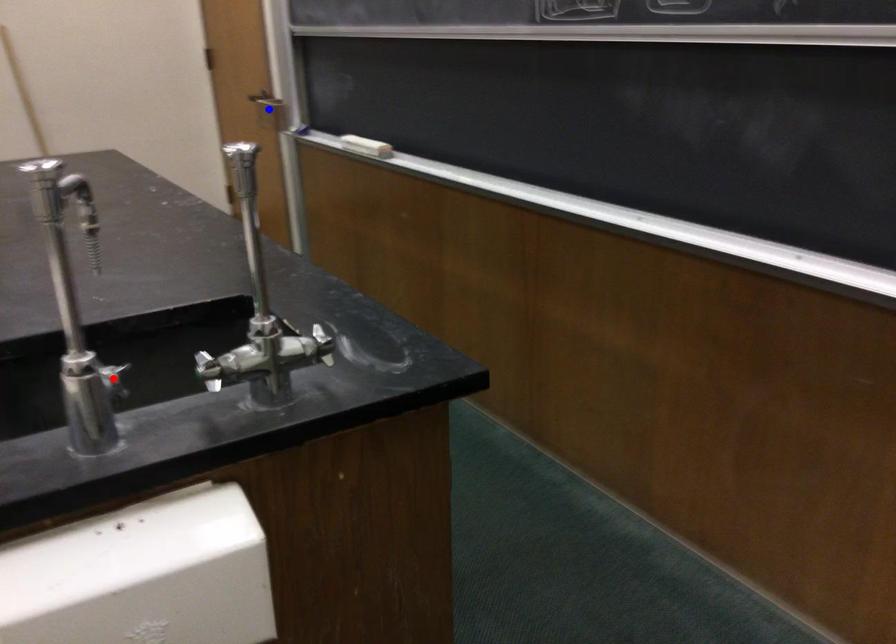
Question: Which of the two points in the image is closer to the camera?

Choices:
 (A) Blue point is closer.
 (B) Red point is closer.

Answer: (B)